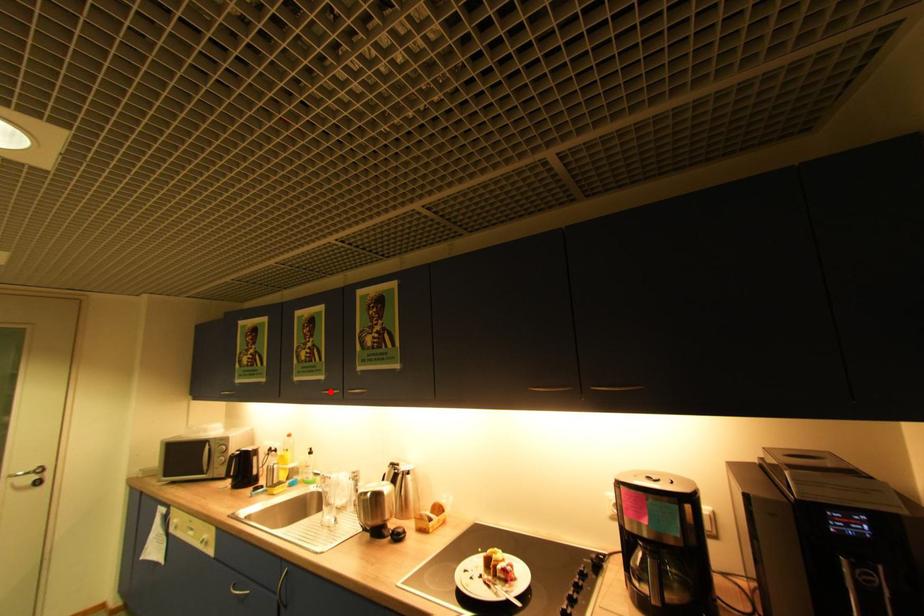
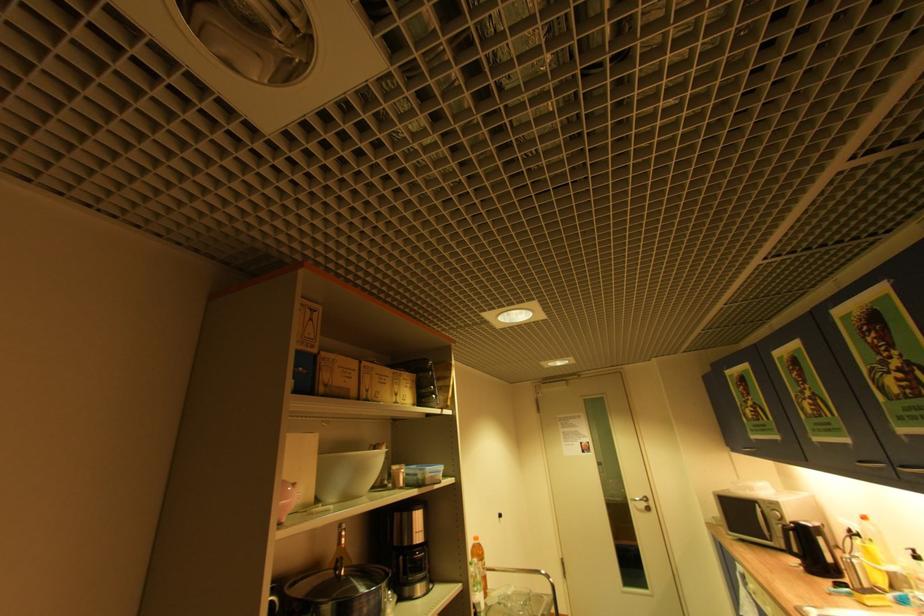
The point at the highlighted location is marked in the first image. Where is the corresponding point in the second image?

(867, 463)